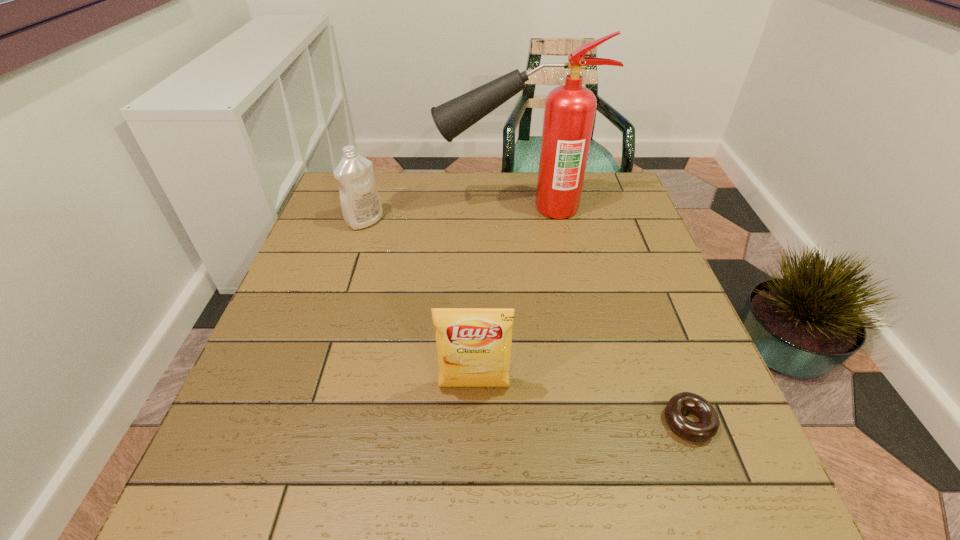
Locate an element on the screen. fire extinguisher is located at coordinates (570, 109).

Image resolution: width=960 pixels, height=540 pixels. What are the coordinates of `detergent` in the screenshot? It's located at (361, 206).

Locate an element on the screen. the third farthest object is located at coordinates (474, 345).

Identify the location of the nearest object. The image size is (960, 540). (708, 425).

Identify the location of the shortest object. The height and width of the screenshot is (540, 960). (708, 425).

Find the location of a particular element. The image size is (960, 540). free space located at the nozzle of the fire extinguisher is located at coordinates (370, 208).

Locate an element on the screen. This screenshot has width=960, height=540. free space located 0.070m at the nozzle of the fire extinguisher is located at coordinates (414, 208).

The image size is (960, 540). I want to click on vacant space located 0.170m at the nozzle of the fire extinguisher, so click(x=379, y=208).

Where is `free point located on the right of the leftmost object`? Image resolution: width=960 pixels, height=540 pixels. free point located on the right of the leftmost object is located at coordinates (515, 221).

The image size is (960, 540). I want to click on vacant space situated 0.180m on the front of the crisp (potato chip) with the logo, so click(x=473, y=498).